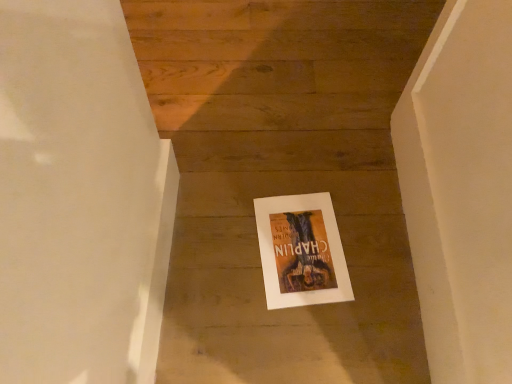
The height and width of the screenshot is (384, 512). What do you see at coordinates (301, 251) in the screenshot?
I see `white paper at center` at bounding box center [301, 251].

Where is `white paper at center`? white paper at center is located at coordinates (301, 251).

You are a GUI agent. You are given a task and a screenshot of the screen. Output one action in this format:
    pyautogui.click(x=<x>, y=<y>)
    Task: Click on the white paper at center
    
    Given the screenshot: What is the action you would take?
    pyautogui.click(x=301, y=251)